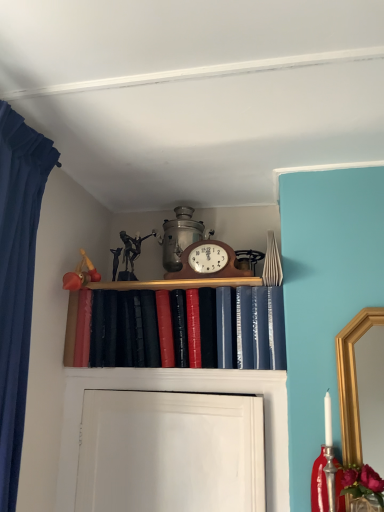
Question: From the image's perspective, is wooden clock at center under shiny leather book at center?

Choices:
 (A) no
 (B) yes

Answer: (A)

Question: Can you confirm if wooden clock at center is positioned to the left of shiny leather book at center?

Choices:
 (A) yes
 (B) no

Answer: (B)

Question: Can you confirm if wooden clock at center is thinner than shiny leather book at center?

Choices:
 (A) yes
 (B) no

Answer: (A)

Question: Is wooden clock at center not inside shiny leather book at center?

Choices:
 (A) yes
 (B) no

Answer: (A)

Question: Is the depth of wooden clock at center greater than that of shiny leather book at center?

Choices:
 (A) yes
 (B) no

Answer: (A)

Question: From the image's perspective, does wooden clock at center appear higher than shiny leather book at center?

Choices:
 (A) yes
 (B) no

Answer: (A)

Question: Is shiny leather book at center at the right side of wooden clock at center?

Choices:
 (A) no
 (B) yes

Answer: (A)

Question: From a real-world perspective, is shiny leather book at center on top of wooden clock at center?

Choices:
 (A) yes
 (B) no

Answer: (B)

Question: From a real-world perspective, does shiny leather book at center sit lower than wooden clock at center?

Choices:
 (A) no
 (B) yes

Answer: (B)

Question: Would you say wooden clock at center is part of shiny leather book at center's contents?

Choices:
 (A) no
 (B) yes

Answer: (A)

Question: Is shiny leather book at center thinner than wooden clock at center?

Choices:
 (A) no
 (B) yes

Answer: (A)

Question: Considering the relative sizes of shiny leather book at center and wooden clock at center in the image provided, is shiny leather book at center taller than wooden clock at center?

Choices:
 (A) yes
 (B) no

Answer: (A)

Question: Is wooden clock at center in front of or behind shiny leather book at center in the image?

Choices:
 (A) behind
 (B) front

Answer: (A)